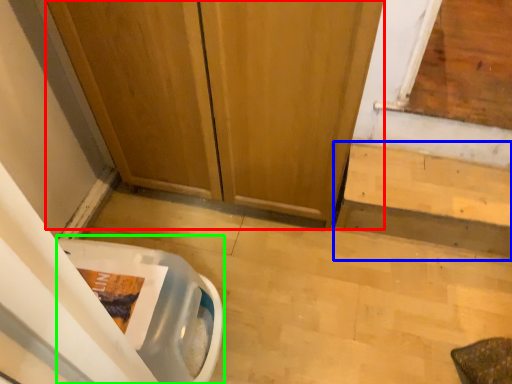
Question: Considering the real-world distances, which object is closest to door (highlighted by a red box)? stairwell (highlighted by a blue box) or toilet bowl (highlighted by a green box).

Choices:
 (A) stairwell
 (B) toilet bowl

Answer: (A)